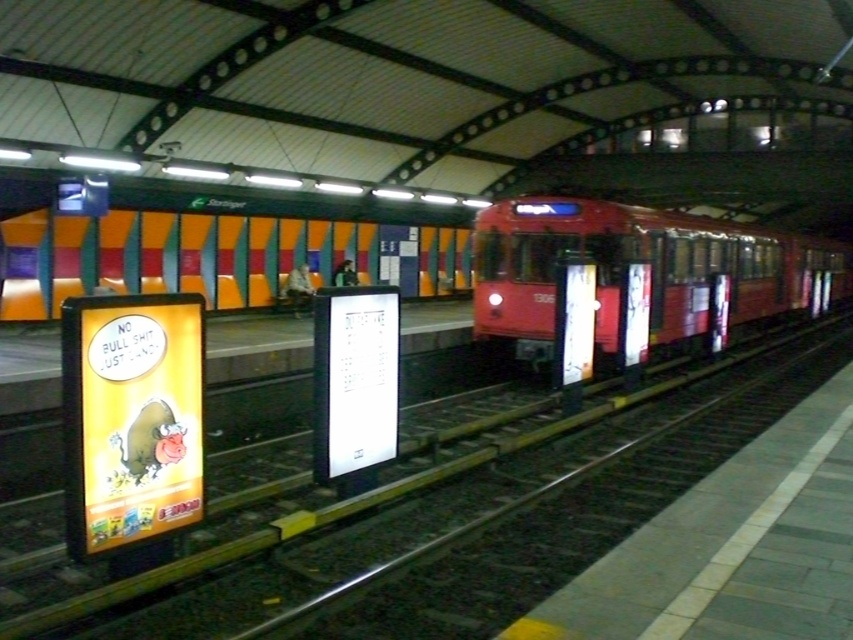
You are waiting for the train at the subway station. You see the metal at left and the matte red train at center. Which object is closer to the entrance of the subway station?

The metal at left is closer to the entrance of the subway station because it is positioned on the left side of the matte red train at center, which is approaching from the right side.

You are a passenger waiting at the subway station. You notice the metal at left and the matte red train at center. Which object is taller?

The matte red train at center is taller than the metal at left.

You are standing on the subway platform and want to touch the metal beams in the ceiling. The point coordinates given are relative to the image frame. Based on the provided coordinates, can you reach the metal beams at point (462, 516)?

The point (462, 516) indicates metal at left, so yes, you can reach the metal beams at that point.